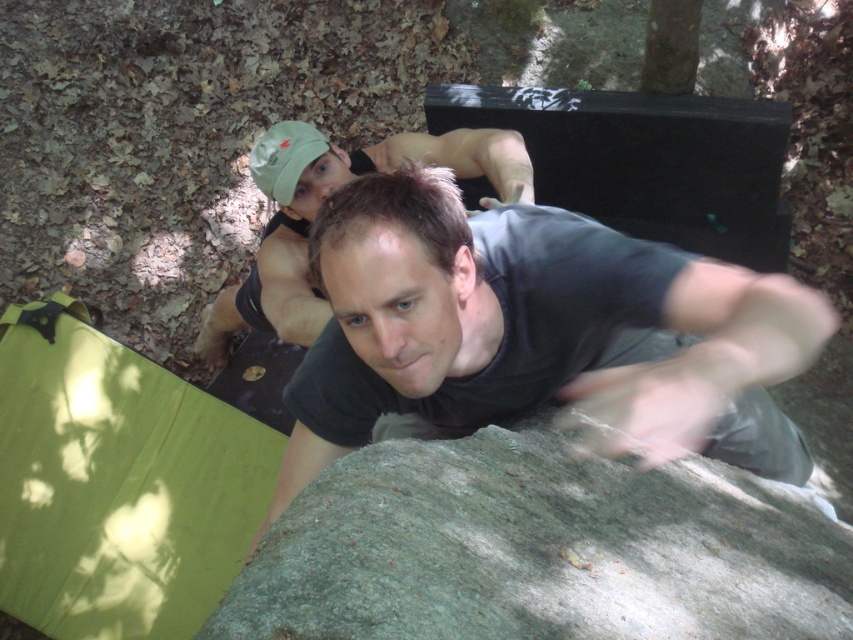
You are a hiker trying to climb the green rough rock at center. You notice the matte black shirt at upper center of another climber. Which object is taller in this scene?

The matte black shirt at upper center is taller than the green rough rock at center.

You are standing in a wooded area with fallen leaves on the ground. You see a green rough rock at center. If you want to reach the rock, which direction should you move relative to your current position?

The green rough rock at center is located at point coordinates, so you should move towards the center of the scene to reach it.